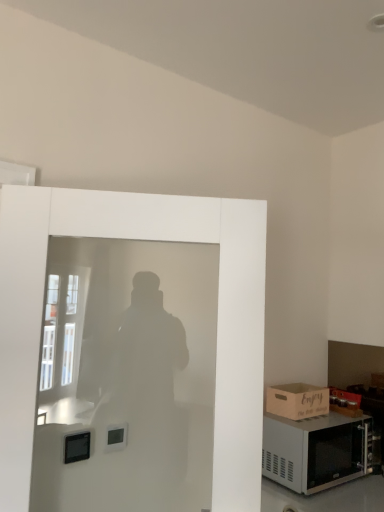
Question: Is brown cardboard box at lower right positioned far away from satin silver microwave at lower right?

Choices:
 (A) yes
 (B) no

Answer: (B)

Question: Can you confirm if brown cardboard box at lower right is bigger than satin silver microwave at lower right?

Choices:
 (A) yes
 (B) no

Answer: (B)

Question: Does brown cardboard box at lower right have a lesser height compared to satin silver microwave at lower right?

Choices:
 (A) no
 (B) yes

Answer: (B)

Question: Is brown cardboard box at lower right to the left of satin silver microwave at lower right from the viewer's perspective?

Choices:
 (A) no
 (B) yes

Answer: (B)

Question: Is brown cardboard box at lower right thinner than satin silver microwave at lower right?

Choices:
 (A) no
 (B) yes

Answer: (B)

Question: Is point (367, 462) closer or farther from the camera than point (322, 392)?

Choices:
 (A) closer
 (B) farther

Answer: (A)

Question: Do you think satin silver microwave at lower right is within brown cardboard box at lower right, or outside of it?

Choices:
 (A) outside
 (B) inside

Answer: (A)

Question: Considering the positions of satin silver microwave at lower right and brown cardboard box at lower right in the image, is satin silver microwave at lower right wider or thinner than brown cardboard box at lower right?

Choices:
 (A) thin
 (B) wide

Answer: (B)

Question: Considering their positions, is satin silver microwave at lower right located in front of or behind brown cardboard box at lower right?

Choices:
 (A) front
 (B) behind

Answer: (A)

Question: In terms of size, does white frosted glass screen door at left appear bigger or smaller than brown cardboard box at lower right?

Choices:
 (A) big
 (B) small

Answer: (A)

Question: In the image, is white frosted glass screen door at left on the left side or the right side of brown cardboard box at lower right?

Choices:
 (A) right
 (B) left

Answer: (B)

Question: Is white frosted glass screen door at left situated inside brown cardboard box at lower right or outside?

Choices:
 (A) inside
 (B) outside

Answer: (B)

Question: Is white frosted glass screen door at left wider or thinner than brown cardboard box at lower right?

Choices:
 (A) wide
 (B) thin

Answer: (B)

Question: Looking at their shapes, would you say brown cardboard box at lower right is wider or thinner than white frosted glass screen door at left?

Choices:
 (A) thin
 (B) wide

Answer: (B)

Question: From the image's perspective, is brown cardboard box at lower right located above or below white frosted glass screen door at left?

Choices:
 (A) above
 (B) below

Answer: (B)